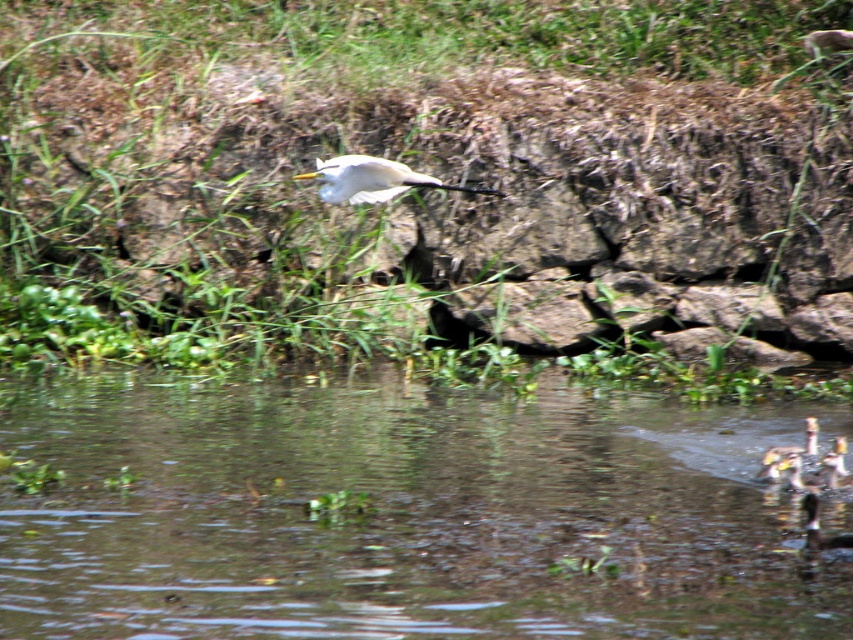
Question: Among these points, which one is farthest from the camera?

Choices:
 (A) (780, 474)
 (B) (312, 460)

Answer: (B)

Question: Can you confirm if white glossy bird at center is positioned above white feathered bird at lower right?

Choices:
 (A) yes
 (B) no

Answer: (A)

Question: Is clear water at lower center closer to camera compared to white feathered bird at lower right?

Choices:
 (A) no
 (B) yes

Answer: (B)

Question: Which point is farther from the camera taking this photo?

Choices:
 (A) (148, 474)
 (B) (804, 454)

Answer: (B)

Question: Which point is closer to the camera?

Choices:
 (A) white glossy bird at center
 (B) white feathered bird at lower right

Answer: (B)

Question: Does clear water at lower center have a smaller size compared to white glossy bird at center?

Choices:
 (A) yes
 (B) no

Answer: (B)